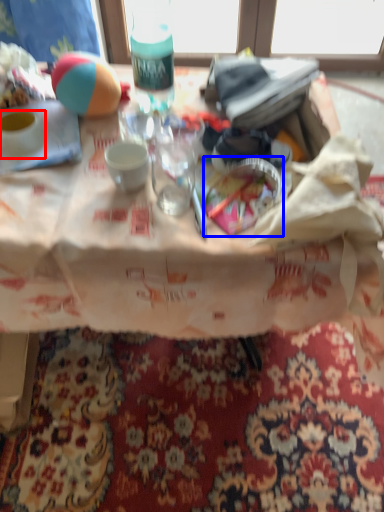
Question: Among these objects, which one is nearest to the camera, coffee cup (highlighted by a red box) or tableware (highlighted by a blue box)?

Choices:
 (A) coffee cup
 (B) tableware

Answer: (B)